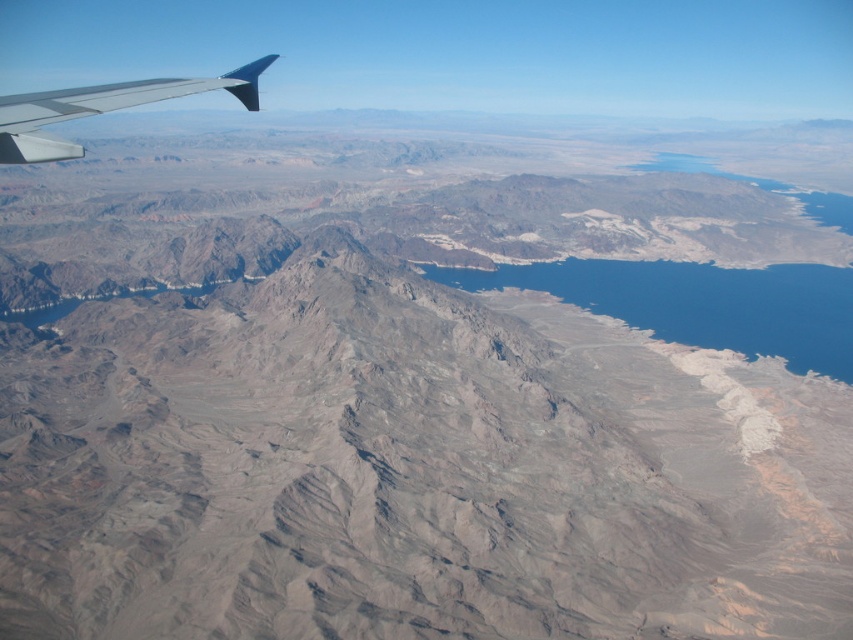
Is blue water at center further to camera compared to metallic gray wing at upper left?

Yes, it is.

Which is in front, point (811, 276) or point (83, 88)?

Point (811, 276) is in front.

The image size is (853, 640). What do you see at coordinates (700, 304) in the screenshot?
I see `blue water at center` at bounding box center [700, 304].

Where is `blue water at center`? This screenshot has height=640, width=853. blue water at center is located at coordinates (700, 304).